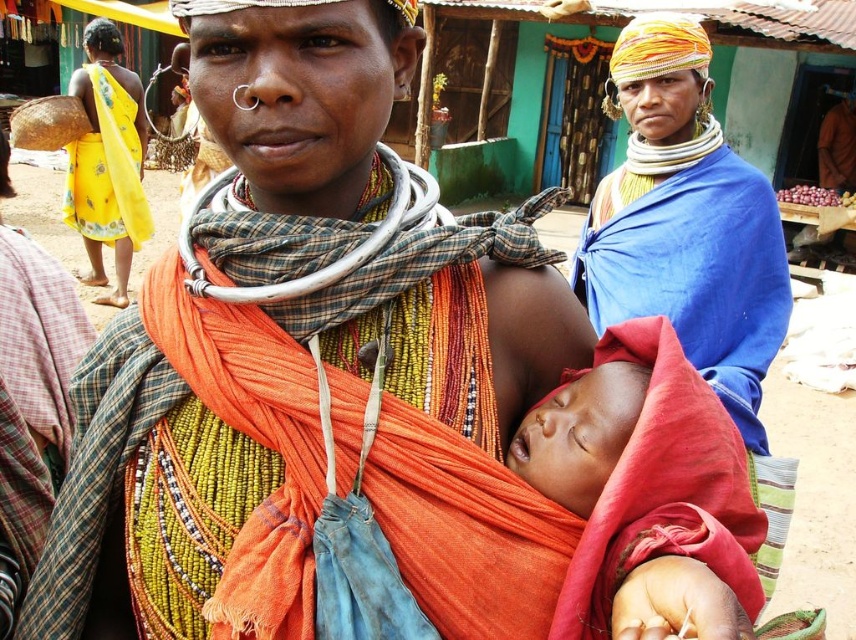
You are a photographer at the market and want to capture the soft red cloth at center and the blue fabric at upper right in the same frame. Which object should you position closer to the left side of your camera viewfinder to ensure both are visible?

To include both the soft red cloth at center and the blue fabric at upper right in the frame, position the soft red cloth at center closer to the left side of the viewfinder since the blue fabric at upper right is already to its right.

You are a photographer at the rural market and want to capture both the blue fabric at upper right and the soft red cloth at center in a single shot. Which fabric should you focus on first to ensure both are in frame?

The blue fabric at upper right is further to the viewer than the soft red cloth at center, so you should focus on the blue fabric at upper right first to ensure both are in frame.